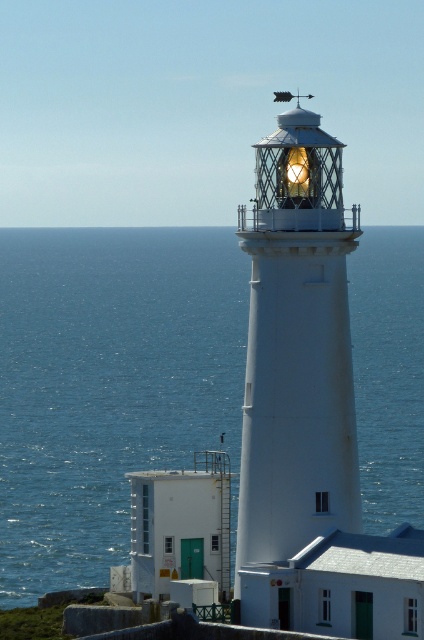
You are standing on the cliff next to the lighthouse and looking out at the scene. Which object, the blue water at center or the matte glass lighthouse at center, appears taller from your vantage point?

The blue water at center appears taller than the matte glass lighthouse at center from your vantage point.

You are standing on the cliff near the lighthouse and want to take a photo of the blue water at center and the matte glass lighthouse at center. Which object should you focus on first to ensure both are in the frame?

You should focus on the blue water at center first because it is closer to you than the matte glass lighthouse at center, ensuring both are in the frame.

You are a tourist standing at the base of the lighthouse and want to take a photo of the blue water at center and the matte glass lighthouse at center. Based on their positions, which object should you frame first in your camera to ensure both are visible in the shot?

The blue water at center is positioned on the left side of matte glass lighthouse at center, so you should frame the blue water at center first on the left side to ensure both are visible in the shot.